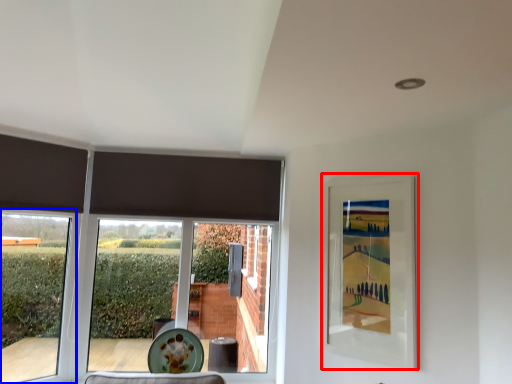
Question: Which of the following is the closest to the observer, picture frame (highlighted by a red box) or window (highlighted by a blue box)?

Choices:
 (A) picture frame
 (B) window

Answer: (A)